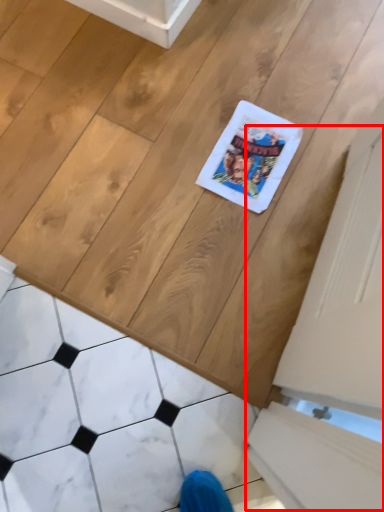
Question: In this image, where is screen door (annotated by the red box) located relative to marble?

Choices:
 (A) left
 (B) right

Answer: (B)